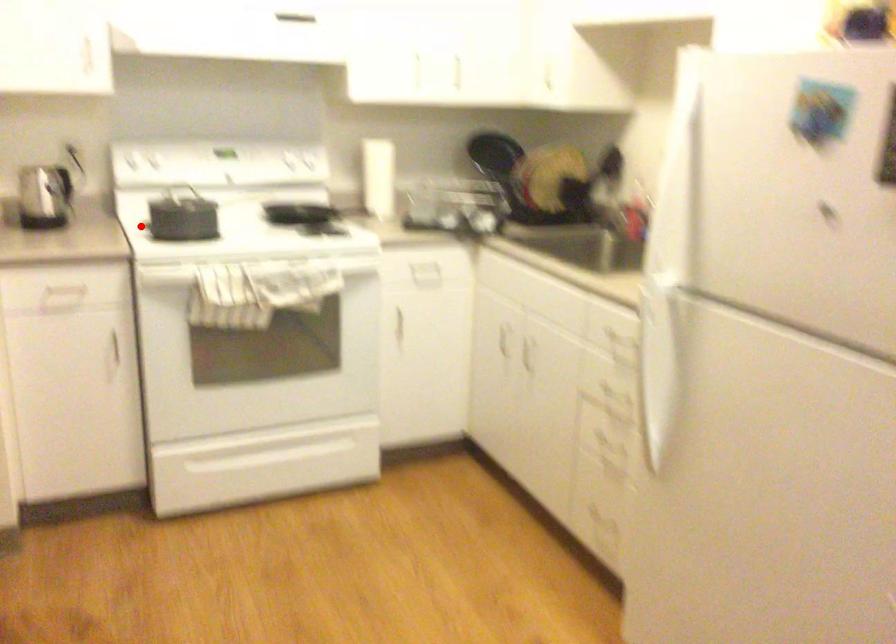
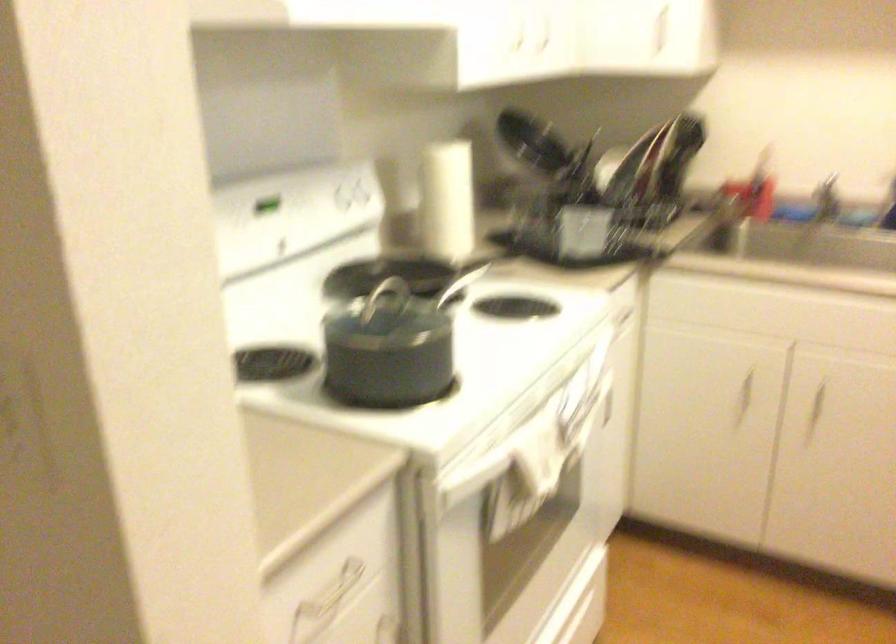
Question: I am providing you with two images of the same scene from different viewpoints. A red point is marked on the first image. Can you still see the location of the red point in image 2?

Choices:
 (A) Yes
 (B) No

Answer: (B)